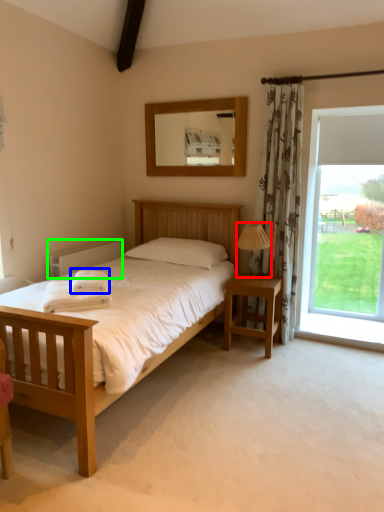
Question: Which is nearer to the lamp (highlighted by a red box)? cloth (highlighted by a blue box) or radiator (highlighted by a green box).

Choices:
 (A) cloth
 (B) radiator

Answer: (A)